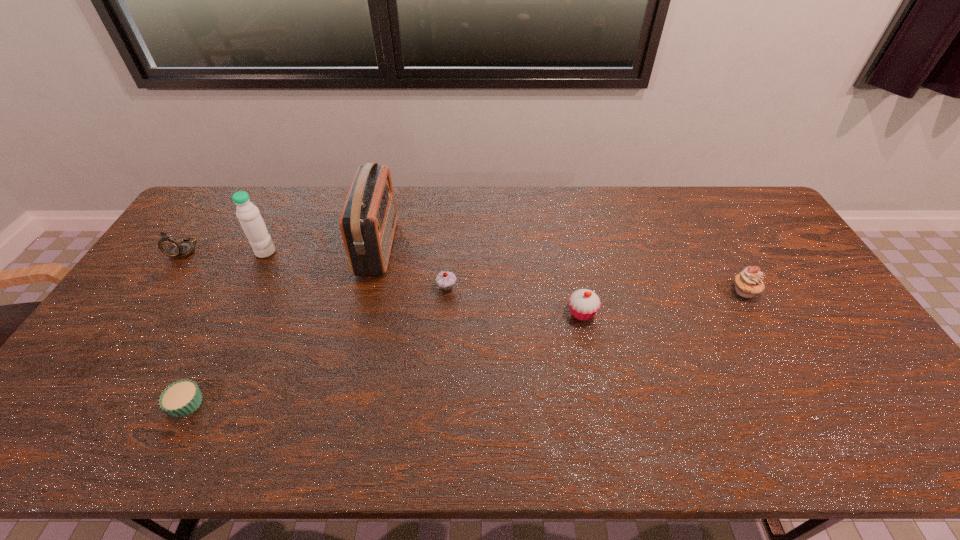
Locate an element on the screen. Image resolution: width=960 pixels, height=540 pixels. vacant space located 0.140m on the face of the leftmost object is located at coordinates (154, 294).

I want to click on blank area located on the back of the rightmost object, so (702, 215).

Identify the location of vacant space situated on the back of the fifth object from left to right. (450, 232).

What are the coordinates of `free space located 0.320m on the right of the sixth object from left to right` in the screenshot? It's located at (710, 313).

This screenshot has height=540, width=960. I want to click on vacant area located on the right of the leftmost cupcake, so [363, 403].

What are the coordinates of `object located in the far edge section of the desktop` in the screenshot? It's located at (368, 220).

Where is `object situated at the near edge`? This screenshot has width=960, height=540. object situated at the near edge is located at coordinates (183, 397).

You are a GUI agent. You are given a task and a screenshot of the screen. Output one action in this format:
    pyautogui.click(x=<x>, y=<y>)
    Task: Click on the object located in the left edge section of the desktop
    The image size is (960, 540).
    Given the screenshot: What is the action you would take?
    pyautogui.click(x=170, y=246)

The image size is (960, 540). Find the location of `vacant space at the far edge`. vacant space at the far edge is located at coordinates (281, 200).

Where is `vacant space at the near edge`? The height and width of the screenshot is (540, 960). vacant space at the near edge is located at coordinates (702, 436).